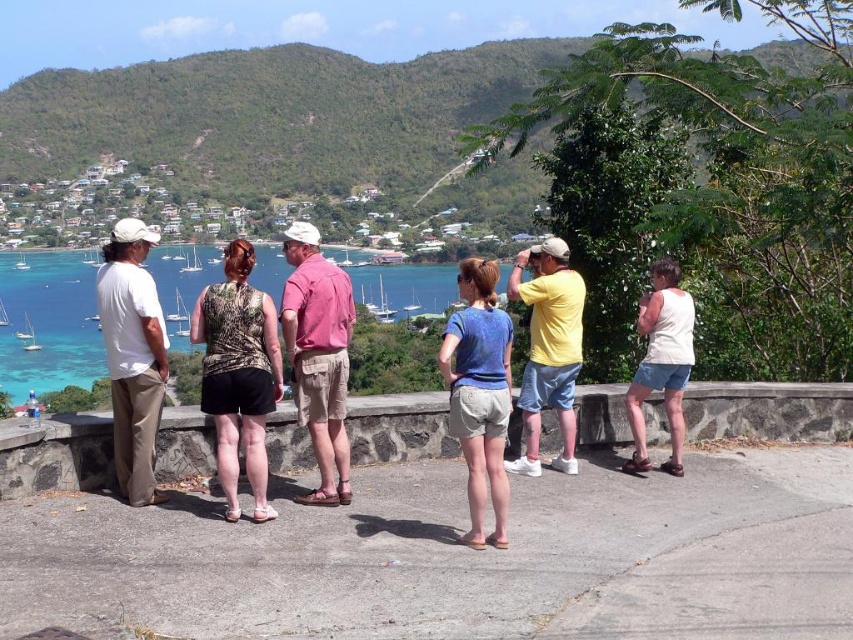
You are a photographer standing at the edge of the paved area where the group is. You want to take a photo that includes both the turquoise water at center and the white cotton shirt at left. Since you can only focus on one object, which one should you focus on to ensure the other appears in the background?

You should focus on the turquoise water at center because it is in front of the white cotton shirt at left, so the shirt will naturally appear in the background when the water is in focus.